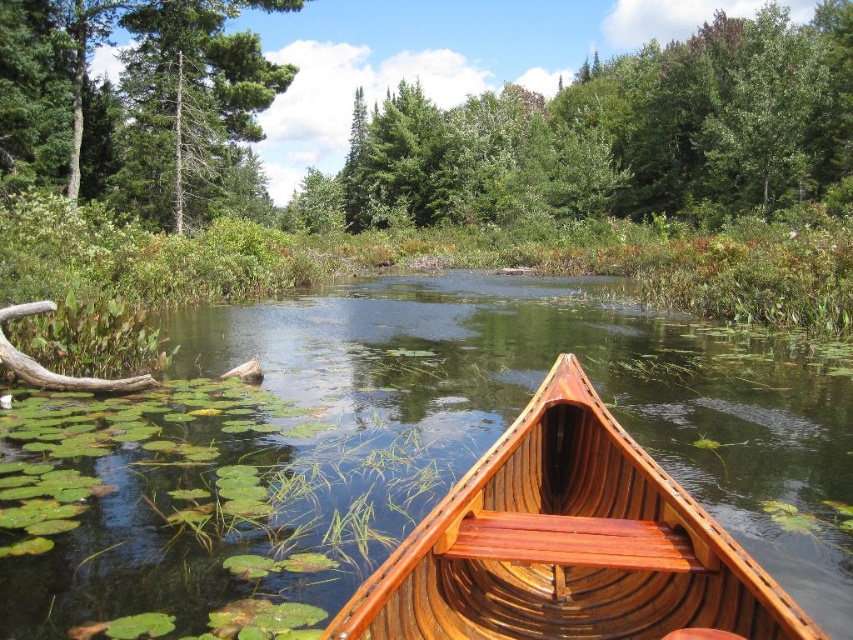
You are standing at the edge of the water and see two points in the scene, point (444, 141) and point (180, 0). Which point is closer to you?

Point (180, 0) is closer to you because it is less further to the camera than point (444, 141).

You are standing on the wooden canoe and looking towards the trees. Which tree is closer to you, the green leafy tree at upper center or the green matte tree at upper left?

The green leafy tree at upper center is closer to you because the green matte tree at upper left is behind it.